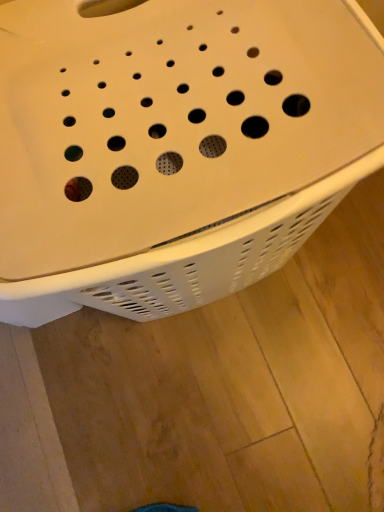
Find the location of a particular element. This screenshot has width=384, height=512. free point above white plastic laundry basket at center (from a real-world perspective) is located at coordinates (151, 117).